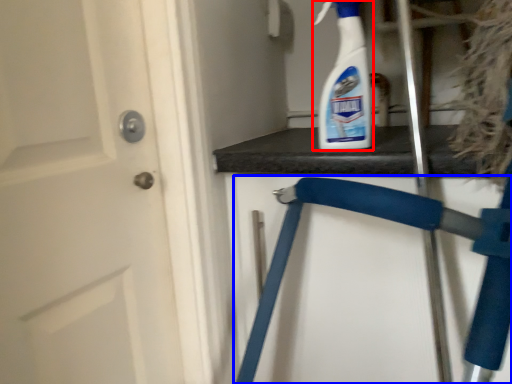
Question: Among these objects, which one is farthest to the camera, cleaning product (highlighted by a red box) or folding chair (highlighted by a blue box)?

Choices:
 (A) cleaning product
 (B) folding chair

Answer: (A)